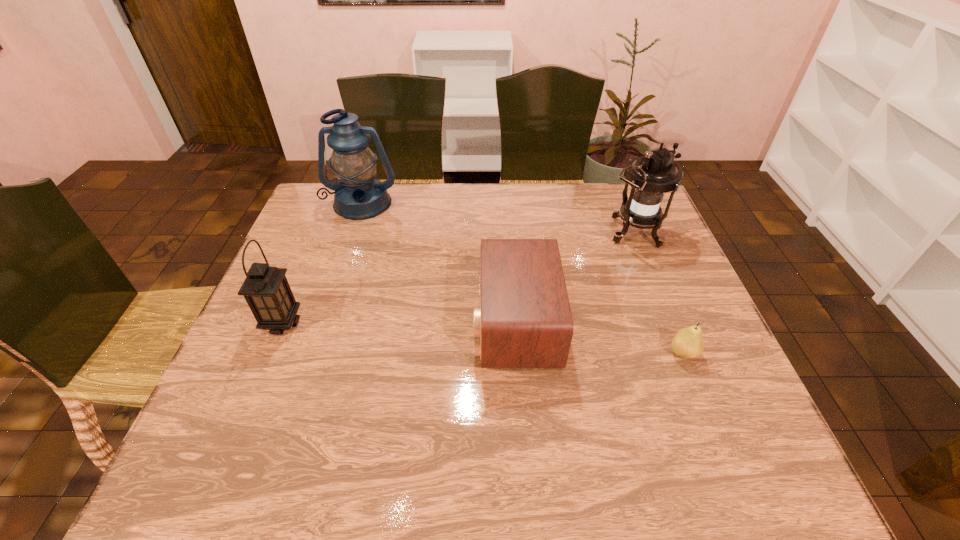
Locate an element on the screen. This screenshot has width=960, height=540. free space between the rightmost lantern and the second shortest object is located at coordinates (574, 279).

You are a GUI agent. You are given a task and a screenshot of the screen. Output one action in this format:
    pyautogui.click(x=<x>, y=<y>)
    Task: Click on the free space between the rightmost lantern and the shortest lantern
    Image resolution: width=960 pixels, height=540 pixels.
    Given the screenshot: What is the action you would take?
    pyautogui.click(x=458, y=279)

Locate an element on the screen. vacant space in between the shortest object and the radio receiver is located at coordinates (599, 338).

Identify the location of vacant space that's between the rightmost lantern and the shortest object. (658, 294).

Where is `vacant region between the rightmost lantern and the nearest lantern`? vacant region between the rightmost lantern and the nearest lantern is located at coordinates (458, 279).

Where is `object that is the fourth nearest to the third shortest object`? This screenshot has height=540, width=960. object that is the fourth nearest to the third shortest object is located at coordinates 687,343.

Where is `object that is the closest one to the pear`? object that is the closest one to the pear is located at coordinates (524, 321).

Locate an element on the screen. the closest lantern relative to the fourth tallest object is located at coordinates (651, 176).

Identify which lantern is located as the nearest to the pear. Please provide its 2D coordinates. Your answer should be formatted as a tuple, i.e. [(x, y)], where the tuple contains the x and y coordinates of a point satisfying the conditions above.

[(651, 176)]

Locate an element on the screen. This screenshot has height=540, width=960. free location that satisfies the following two spatial constraints: 1. on the front side of the rightmost lantern; 2. on the left side of the pear is located at coordinates (681, 353).